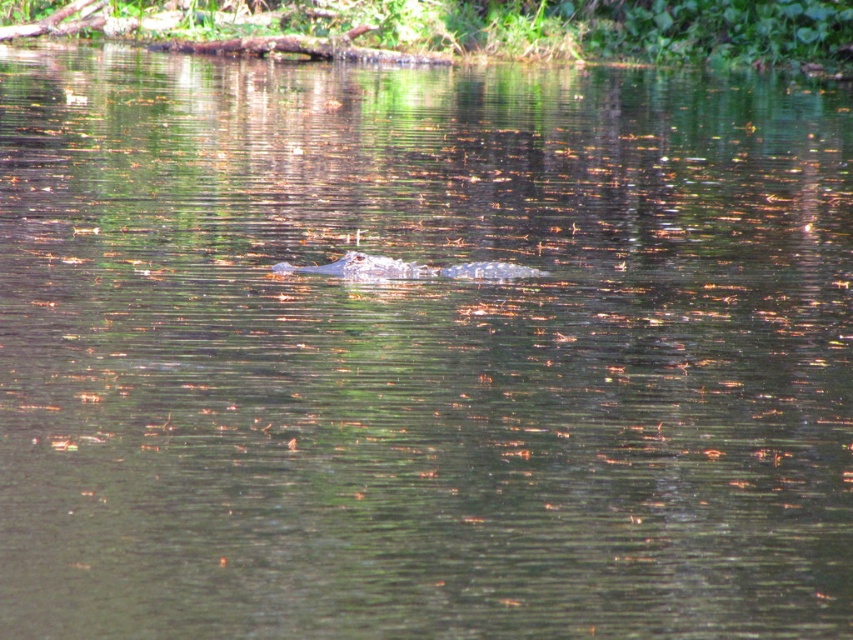
You are standing at the edge of the water and see the point marked at coordinates (469, 28). What is the object located at that point?

The point at coordinates (469, 28) corresponds to green leafy vegetation at upper center.